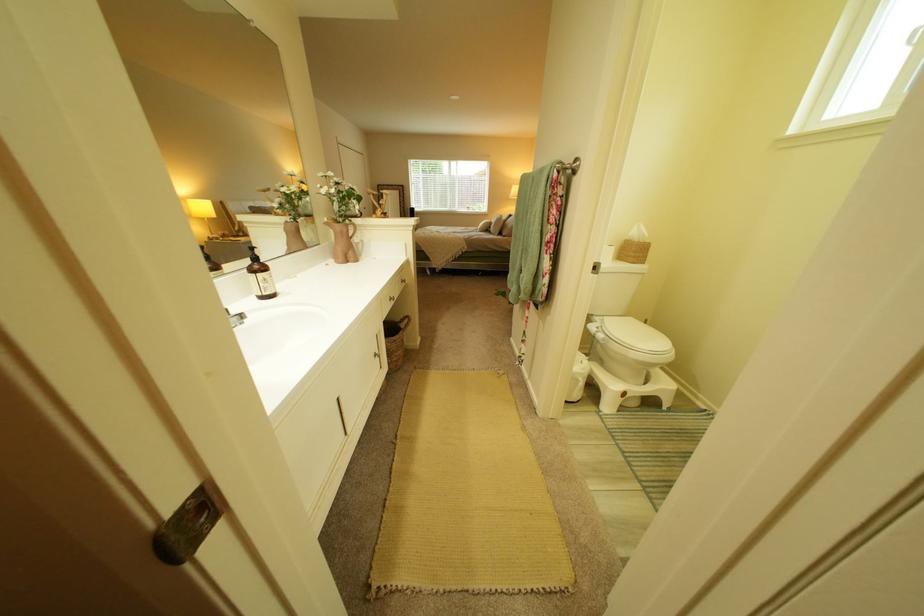
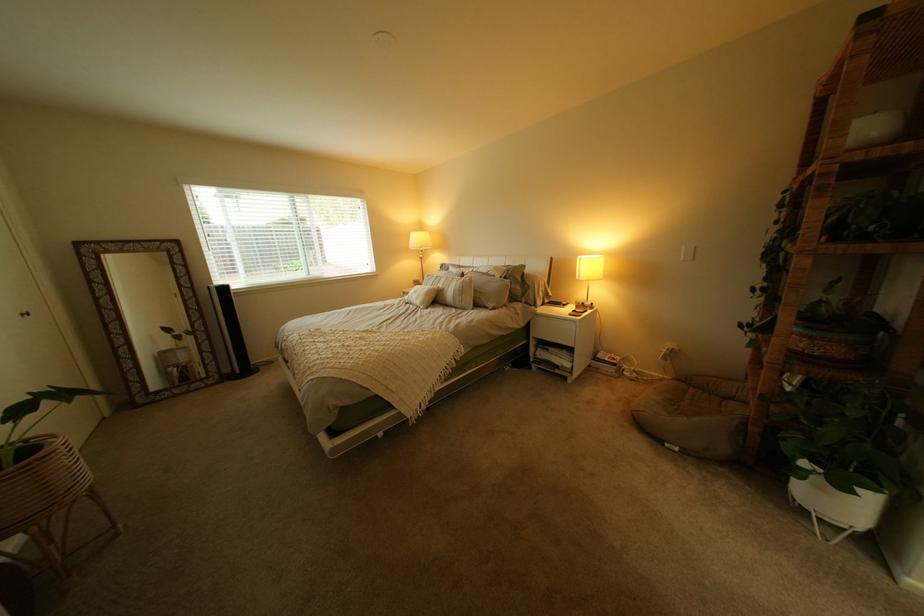
Locate, in the second image, the point that corresponds to point 519,238 in the first image.

(509, 310)